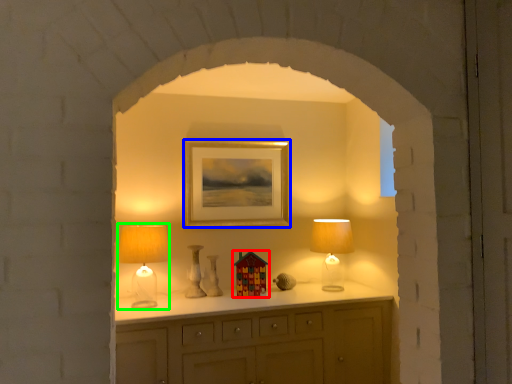
Question: Which is farther away from toy (highlighted by a red box)? picture frame (highlighted by a blue box) or table lamp (highlighted by a green box)?

Choices:
 (A) picture frame
 (B) table lamp

Answer: (B)